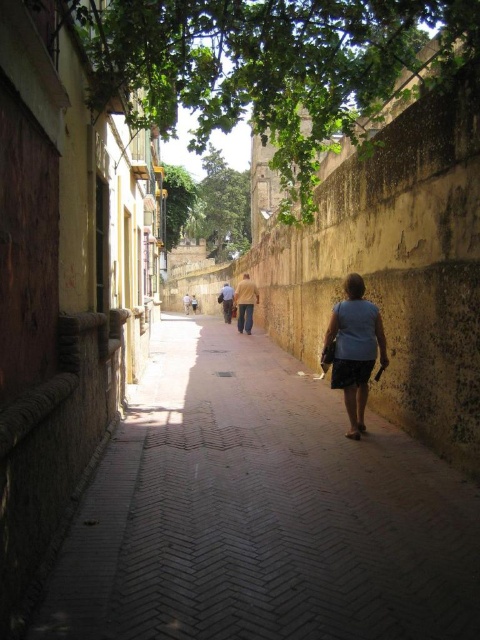
Question: Which of the following is the closest to the observer?

Choices:
 (A) brick paved walkway at center
 (B) matte gray shirt at center

Answer: (A)

Question: Can you confirm if brick paved walkway at center is wider than matte gray shirt at center?

Choices:
 (A) yes
 (B) no

Answer: (A)

Question: From the image, what is the correct spatial relationship of brick paved walkway at center in relation to matte gray shirt at center?

Choices:
 (A) left
 (B) right

Answer: (A)

Question: Which point is farther to the camera?

Choices:
 (A) (336, 353)
 (B) (195, 412)

Answer: (B)

Question: Which of the following is the farthest from the observer?

Choices:
 (A) matte gray shirt at center
 (B) brick paved walkway at center

Answer: (A)

Question: Does brick paved walkway at center have a larger size compared to matte gray shirt at center?

Choices:
 (A) yes
 (B) no

Answer: (A)